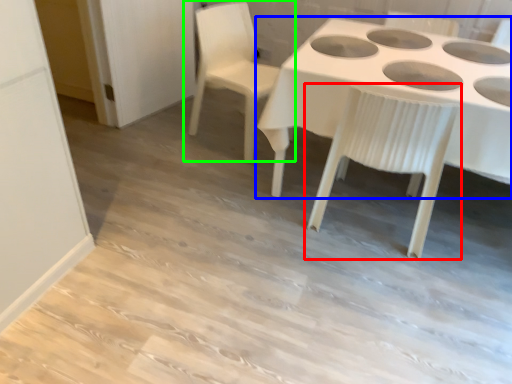
Question: Which object is positioned farthest from chair (highlighted by a red box)? Select from table (highlighted by a blue box) and chair (highlighted by a green box).

Choices:
 (A) table
 (B) chair

Answer: (B)